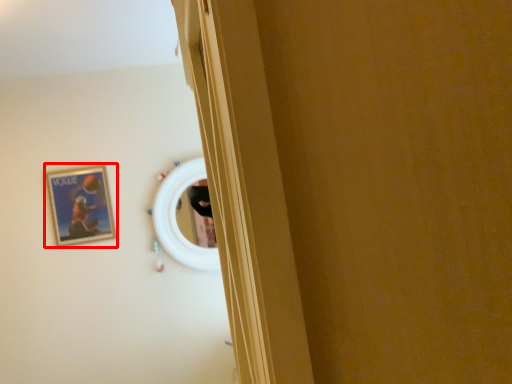
Question: From the image's perspective, where is picture frame (annotated by the red box) located relative to mirror?

Choices:
 (A) below
 (B) above

Answer: (B)